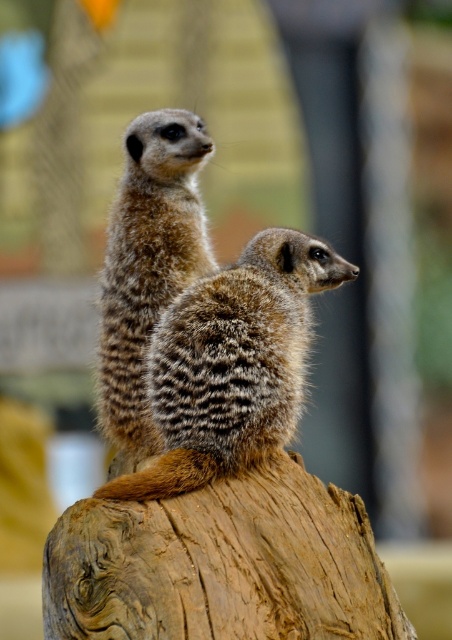
You are a wildlife photographer trying to capture a photo of two meerkats. You notice the brown fuzzy meerkat at center and the fuzzy brown meerkat at upper left. Which meerkat is shorter?

The brown fuzzy meerkat at center is shorter than the fuzzy brown meerkat at upper left.

Based on the photo, you are a wildlife photographer trying to capture a closeup shot of the meerkats. You have a lens that can focus on objects up to 1 meter away. The brown fuzzy meerkat at center is 0.8 meters away from your camera, while the fuzzy brown meerkat at upper left is 1.2 meters away. Which meerkat will be in focus and appear sharp in your photo?

The brown fuzzy meerkat at center is within the 1 meter range of your lens, so it will be in focus. The fuzzy brown meerkat at upper left is beyond the 1 meter limit and will appear blurry.